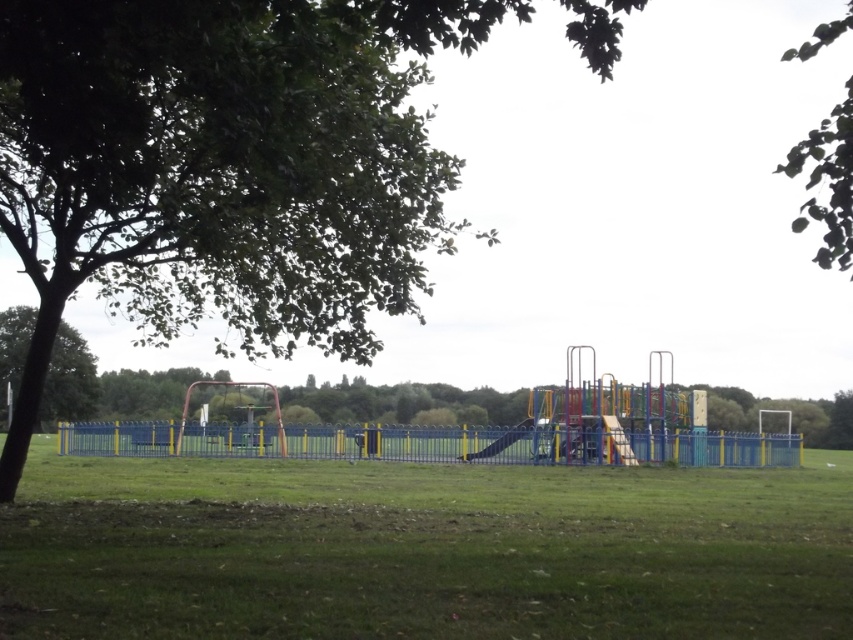
You are a parent trying to decide where to sit while watching your children play in the playground. You have two options in the image provided. One is the green grassy field at center and the other is the green leafy tree at left. Which location would allow you to see your children more clearly?

The green grassy field at center has a lesser height compared to the green leafy tree at left, so sitting on the green grassy field at center would provide a better view since it is lower and less obstructive.

You are standing at the entrance of the playground and want to take a photo that includes both the point at coordinates point [222,156] and point [28,324]. Which point will appear larger in your photo?

Point [222,156] is closer to the camera than point [28,324], so it will appear larger in the photo.

You are a parent trying to find a spot to set up a picnic blanket in the children playground. You see the green grassy field at center and the green leafy tree at left. Which area is wider so that you can spread out more?

The green grassy field at center is wider than the green leafy tree at left, so you can spread out more there.